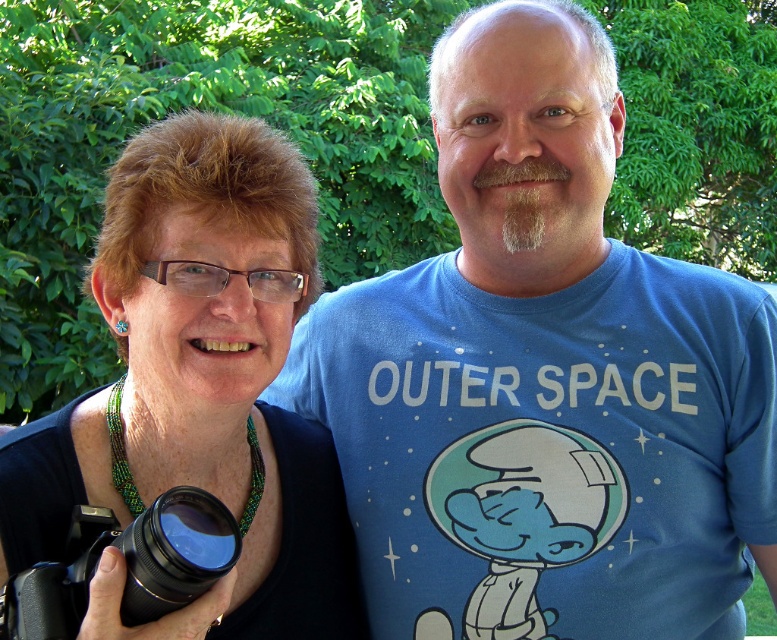
This screenshot has height=640, width=777. What do you see at coordinates (199, 385) in the screenshot?
I see `black matte camera at left` at bounding box center [199, 385].

Who is higher up, black matte camera at left or black plastic camera at lower left?

Positioned higher is black matte camera at left.

In order to click on black matte camera at left in this screenshot , I will do `click(199, 385)`.